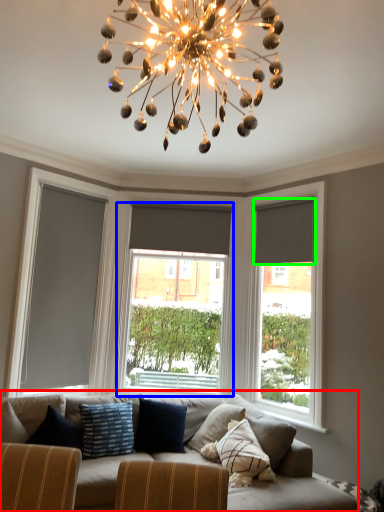
Question: Estimate the real-world distances between objects in this image. Which object is farther from studio couch (highlighted by a red box), window (highlighted by a blue box) or curtain (highlighted by a green box)?

Choices:
 (A) window
 (B) curtain

Answer: (A)